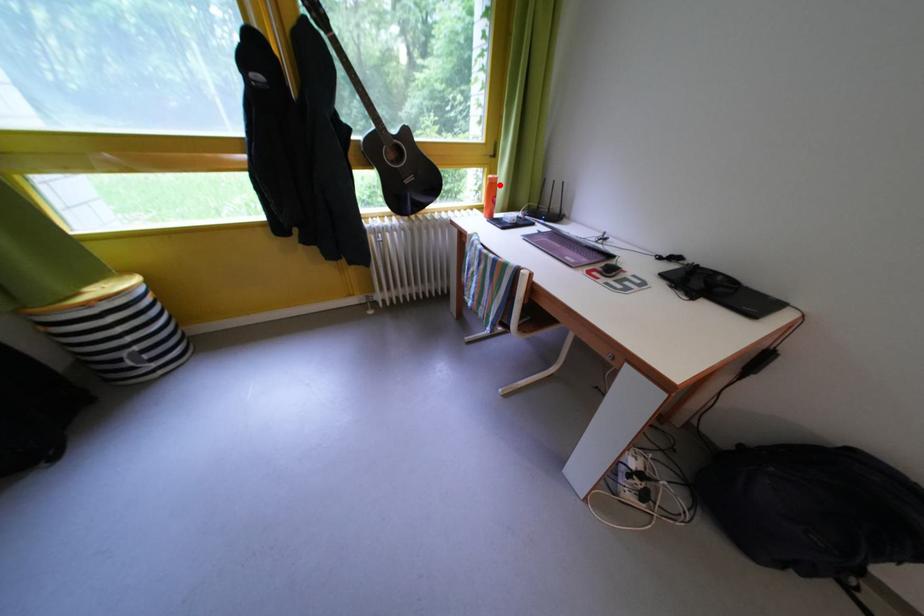
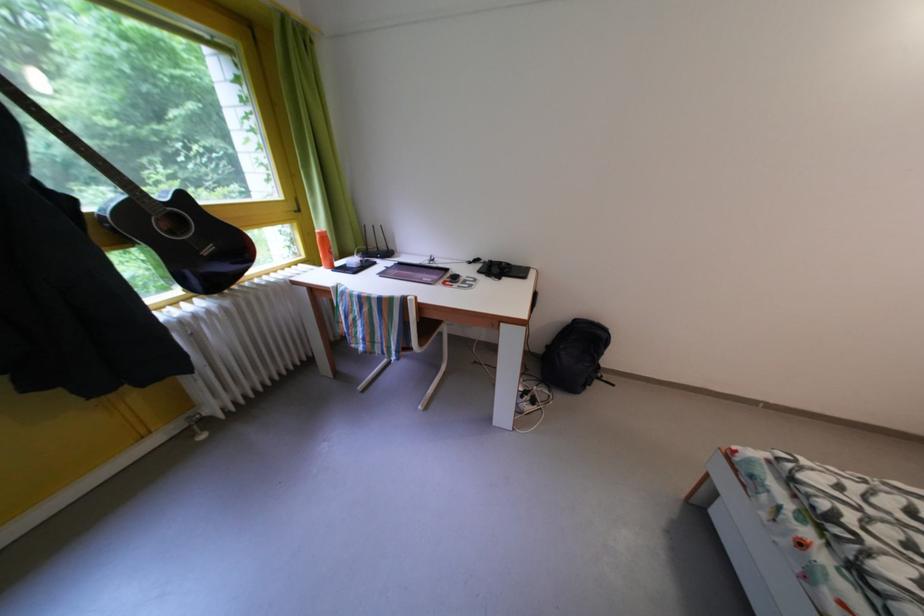
In the second image, find the point that corresponds to the highlighted location in the first image.

(329, 238)